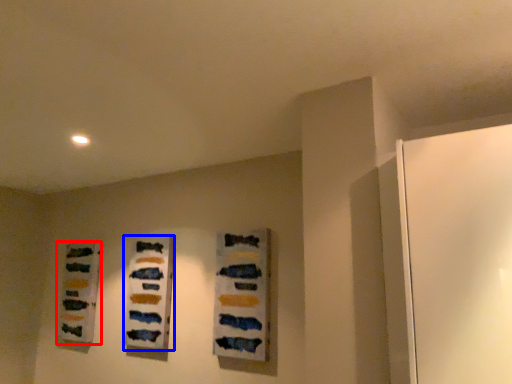
Question: Which of the following is the closest to the observer, art (highlighted by a red box) or art (highlighted by a blue box)?

Choices:
 (A) art
 (B) art

Answer: (B)